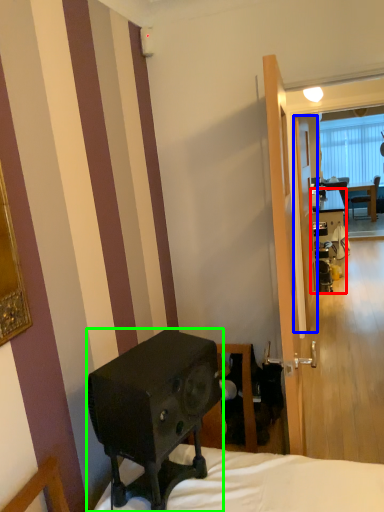
Question: Which object is positioned closest to desk (highlighted by a red box)? Select from screen door (highlighted by a blue box) and loudspeaker (highlighted by a green box).

Choices:
 (A) screen door
 (B) loudspeaker

Answer: (A)